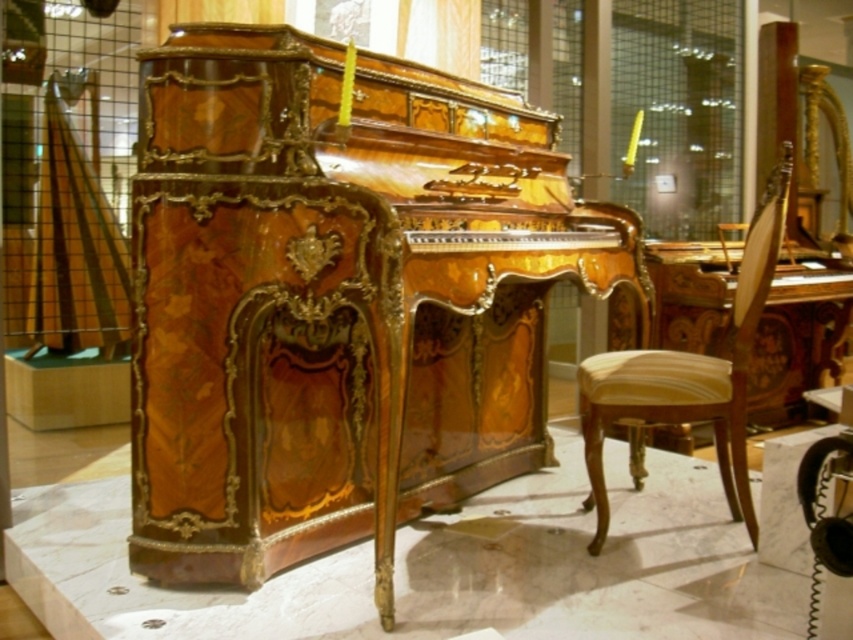
Question: Which point is farther to the camera?

Choices:
 (A) (260, 376)
 (B) (733, 362)
 (C) (1, 272)

Answer: (C)

Question: Is glossy wood piano at center to the right of wooden pillar at center from the viewer's perspective?

Choices:
 (A) yes
 (B) no

Answer: (A)

Question: Which of the following is the farthest from the observer?

Choices:
 (A) (593, 490)
 (B) (4, 480)
 (C) (368, 225)

Answer: (B)

Question: Is glossy wood piano at center thinner than wooden pillar at center?

Choices:
 (A) yes
 (B) no

Answer: (B)

Question: Which point is closer to the camera taking this photo?

Choices:
 (A) (469, 369)
 (B) (584, 422)
 (C) (0, 156)

Answer: (B)

Question: Can you confirm if yellow upholstered chair at center is bigger than wooden pillar at center?

Choices:
 (A) no
 (B) yes

Answer: (B)